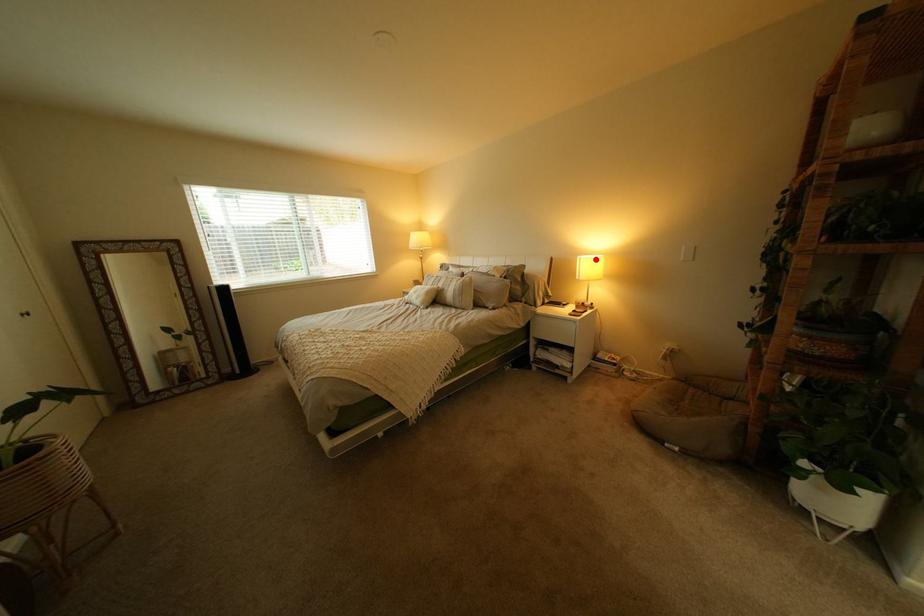
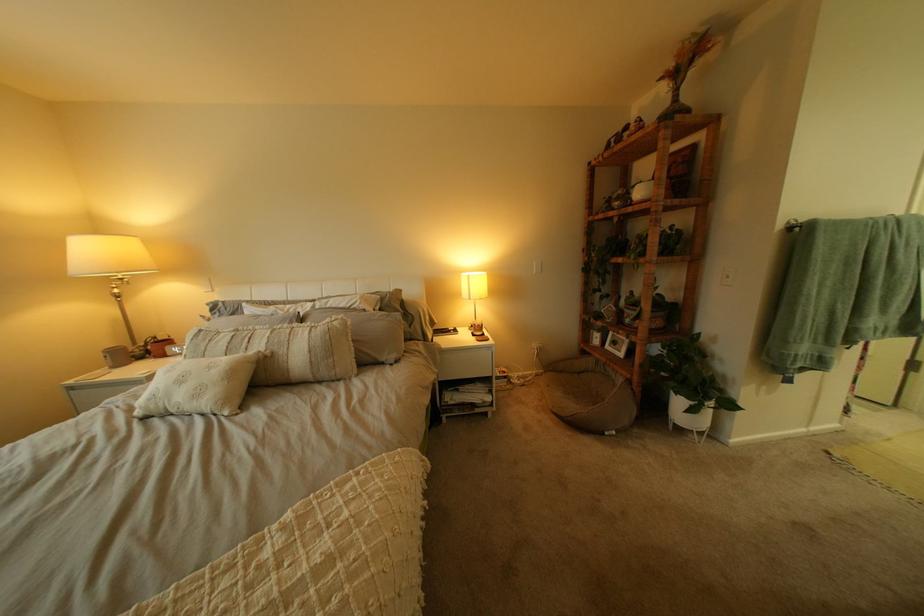
Where in the second image is the point corresponding to the highlighted location from the first image?

(483, 277)